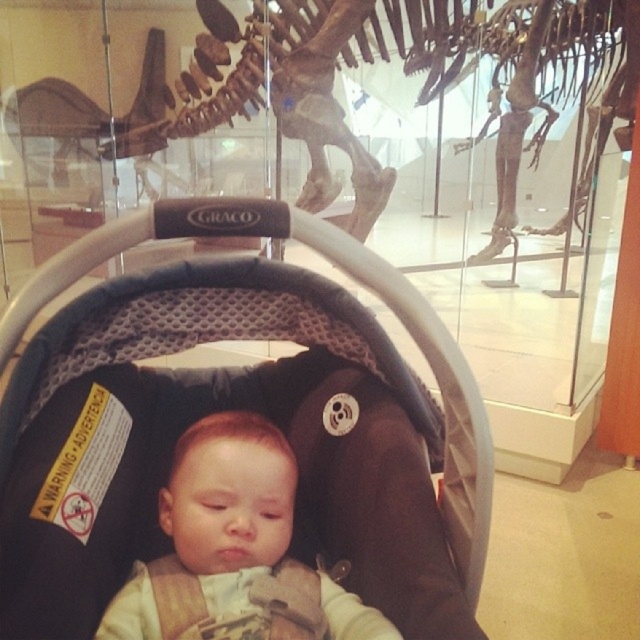
You are standing in a museum and see a Graco car seat with a baby inside. There is a point at coordinates point (x=134, y=417) that you want to reach with a 3.5 feet long tool. Can the tool reach that point?

The distance of point (x=134, y=417) from camera is 3.68 feet, so the 3.5 feet long tool cannot reach it because it is slightly farther than the tool length.

You are a parent trying to ensure your baby is safely secured in the black mesh car seat at center. From your perspective, is the smooth beige baby at center positioned in front of or behind the car seat?

The smooth beige baby at center is positioned behind the black mesh car seat at center because the car seat is closer to the viewer, meaning the baby is situated behind it.